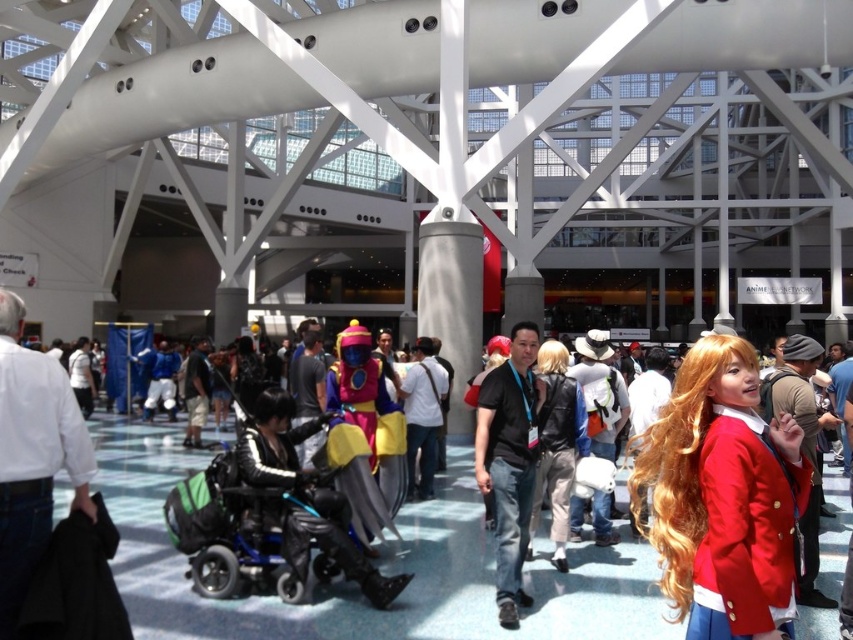
Question: Based on their relative distances, which object is nearer to the black matte shirt at center?

Choices:
 (A) shiny metallic costume at center
 (B) satin red blazer at center

Answer: (A)

Question: Does satin red blazer at center have a smaller size compared to shiny metallic costume at center?

Choices:
 (A) yes
 (B) no

Answer: (B)

Question: Estimate the real-world distances between objects in this image. Which object is farther from the shiny metallic costume at center?

Choices:
 (A) satin red blazer at center
 (B) black matte shirt at center

Answer: (A)

Question: In this image, where is satin red blazer at center located relative to shiny metallic costume at center?

Choices:
 (A) right
 (B) left

Answer: (A)

Question: Is satin red blazer at center smaller than shiny metallic costume at center?

Choices:
 (A) yes
 (B) no

Answer: (B)

Question: Based on their relative distances, which object is nearer to the black matte shirt at center?

Choices:
 (A) shiny metallic costume at center
 (B) satin red blazer at center

Answer: (A)